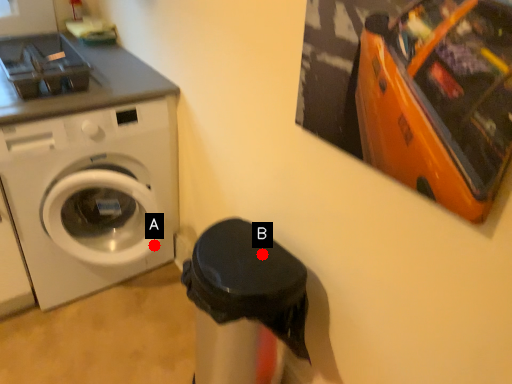
Question: Two points are circled on the image, labeled by A and B beside each circle. Which of the following is the closest to the observer?

Choices:
 (A) A is closer
 (B) B is closer

Answer: (B)